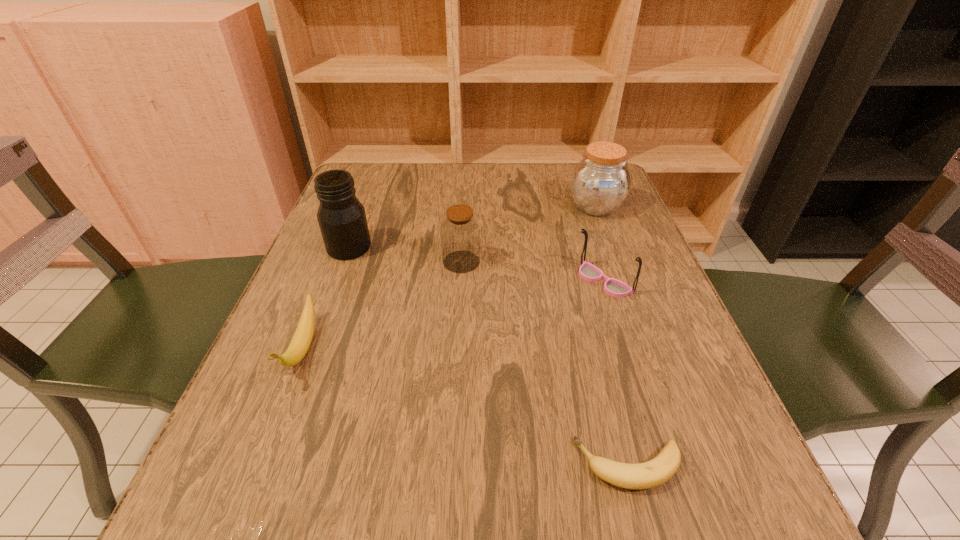
The height and width of the screenshot is (540, 960). Find the location of `vacant space at the right edge of the desktop`. vacant space at the right edge of the desktop is located at coordinates (647, 437).

Where is `free space at the far left corner`? The height and width of the screenshot is (540, 960). free space at the far left corner is located at coordinates (381, 173).

You are a GUI agent. You are given a task and a screenshot of the screen. Output one action in this format:
    pyautogui.click(x=<x>, y=<y>)
    Task: Click on the vacant area at the far right corner of the desktop
    The image size is (960, 540).
    Given the screenshot: What is the action you would take?
    pyautogui.click(x=566, y=166)

I want to click on empty location between the spectacles and the farthest object, so click(599, 244).

Locate an element on the screen. This screenshot has width=960, height=540. free space between the right banana and the leftmost jar is located at coordinates (489, 356).

Locate an element on the screen. This screenshot has height=540, width=960. free point between the fifth tallest object and the fourth tallest object is located at coordinates (453, 315).

You are a GUI agent. You are given a task and a screenshot of the screen. Output one action in this format:
    pyautogui.click(x=<x>, y=<y>)
    Task: Click on the vacant region between the taller banana and the shortest object
    This screenshot has height=540, width=960.
    Given the screenshot: What is the action you would take?
    pyautogui.click(x=466, y=407)

Image resolution: width=960 pixels, height=540 pixels. I want to click on free spot between the shortest object and the farthest object, so click(x=612, y=336).

You are a GUI agent. You are given a task and a screenshot of the screen. Output one action in this format:
    pyautogui.click(x=<x>, y=<y>)
    Task: Click on the vacant space that is in between the leftmost jar and the fourth shortest object
    This screenshot has height=540, width=960.
    Given the screenshot: What is the action you would take?
    pyautogui.click(x=405, y=254)

This screenshot has width=960, height=540. In order to click on free space between the farthest object and the fourth shortest object in this screenshot , I will do (529, 234).